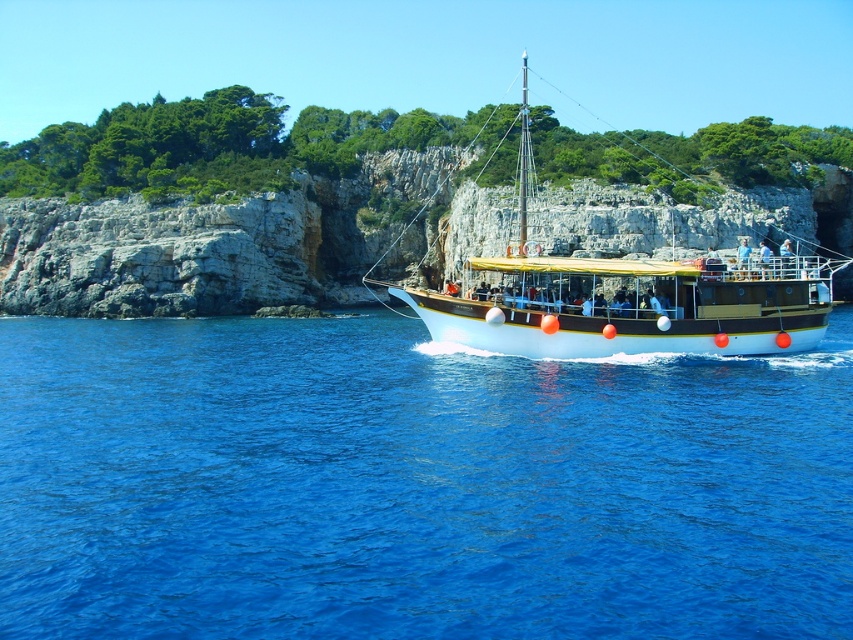
Does blue liquid water at center appear under white wooden boat at center?

Yes, blue liquid water at center is below white wooden boat at center.

Can you confirm if blue liquid water at center is thinner than white wooden boat at center?

No.

Measure the distance between blue liquid water at center and camera.

A distance of 24.62 meters exists between blue liquid water at center and camera.

Identify the location of blue liquid water at center. The height and width of the screenshot is (640, 853). (413, 484).